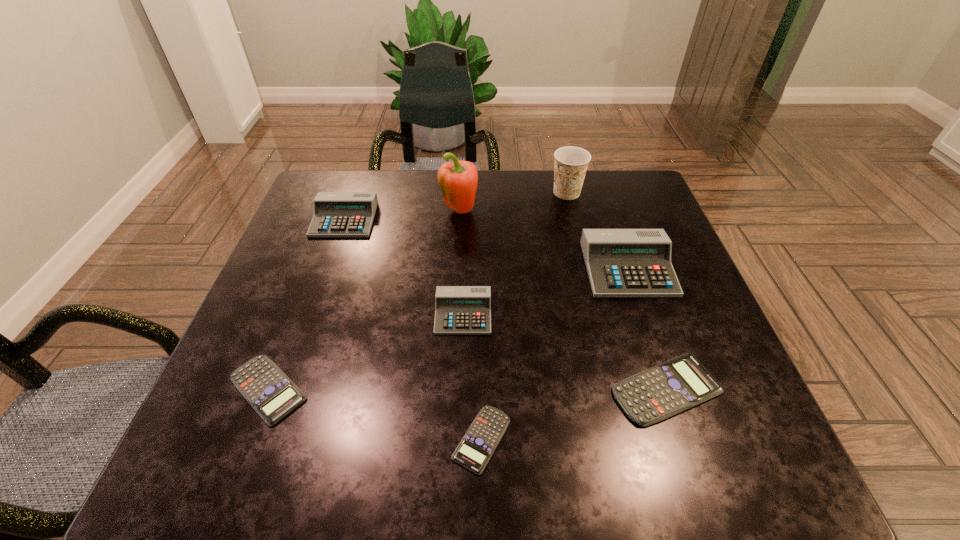
In the image, there is a desktop. Identify the location of free space at the far edge. (506, 218).

In the image, there is a desktop. What are the coordinates of `vacant area at the near edge` in the screenshot? It's located at (419, 454).

The width and height of the screenshot is (960, 540). What are the coordinates of `vacant space at the left edge of the desktop` in the screenshot? It's located at (312, 312).

What are the coordinates of `vacant area at the right edge` in the screenshot? It's located at (745, 399).

Where is `vacant space at the far left corner of the desktop`? vacant space at the far left corner of the desktop is located at coordinates coord(331,186).

In order to click on vacant space at the far right corner of the desktop in this screenshot , I will do `click(613, 191)`.

The height and width of the screenshot is (540, 960). What are the coordinates of `free space at the near right corner` in the screenshot? It's located at (698, 436).

Find the location of a particular element. The image size is (960, 540). free spot between the second tallest object and the second shortest calculator is located at coordinates (418, 291).

Identify the location of empty location between the farthest calculator and the third shortest object. Image resolution: width=960 pixels, height=540 pixels. click(x=505, y=304).

Locate an element on the screen. This screenshot has width=960, height=540. unoccupied area between the sixth tallest object and the tallest calculator is located at coordinates (647, 329).